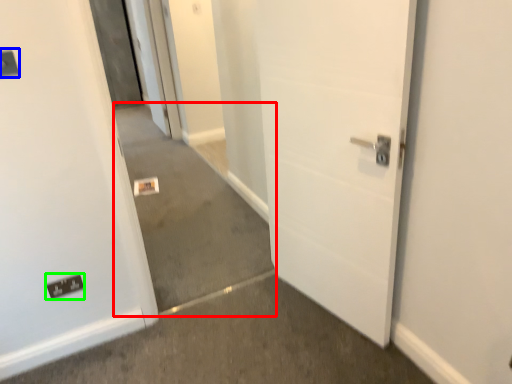
Question: Which object is positioned closest to concrete (highlighted by a red box)? Select from light switch (highlighted by a blue box) and electric outlet (highlighted by a green box).

Choices:
 (A) light switch
 (B) electric outlet

Answer: (B)